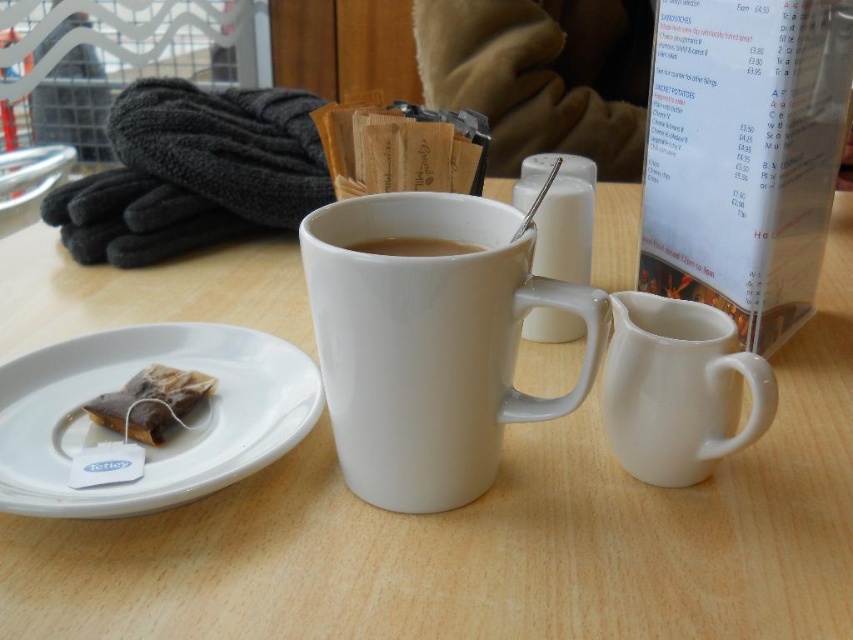
You are a barista preparing a customer order. You need to add cream to their tea. The customer specified they want the cream poured directly into the tea mug first before adding the tea. Based on the scene, is the white glossy creamer at right positioned in a way that allows you to easily pour cream into the brown paper tea bag at left without moving any other items?

The white glossy creamer at right is in front of the brown paper tea bag at left, so pouring cream into the tea bag would not be possible since the creamer is blocking access to the tea bag. The creamer should be moved to access the tea bag.

In the scene shown: You are a barista preparing a cup of tea. You need to place the brown paper tea bag at left on top of the white ceramic saucer at lower left. Is this possible given their sizes?

The white ceramic saucer at lower left is much taller than the brown paper tea bag at left, so placing the tea bag on top of the saucer would be possible as the saucer provides a stable base.

You are a barista preparing a customer order. You need to place both the white glossy creamer at right and the brown paper tea bag at left on a shelf that can only hold items up to 10 cm in width. Which item should you place first to ensure both fit?

The brown paper tea bag at left is narrower than the white glossy creamer at right. Since the creamer might be wider, you should place the narrower tea bag first to make space for the creamer if it fits within the 10 cm limit.